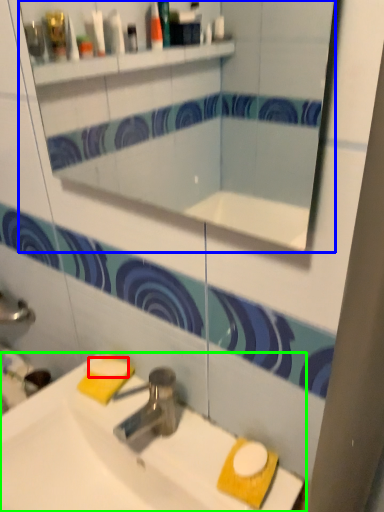
Question: Based on their relative distances, which object is farther from soap (highlighted by a red box)? Choose from mirror (highlighted by a blue box) and sink (highlighted by a green box).

Choices:
 (A) mirror
 (B) sink

Answer: (A)